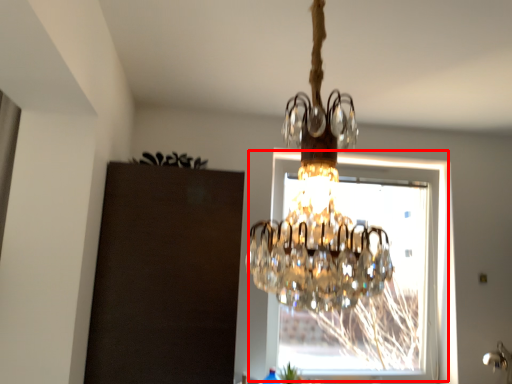
Question: From the image's perspective, what is the correct spatial positioning of window (annotated by the red box) in reference to plant?

Choices:
 (A) below
 (B) above

Answer: (B)